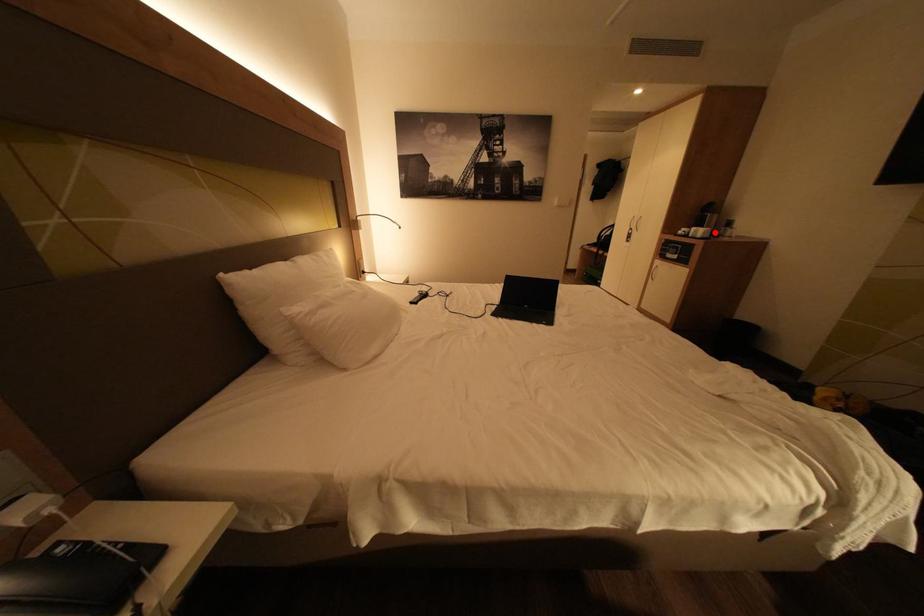
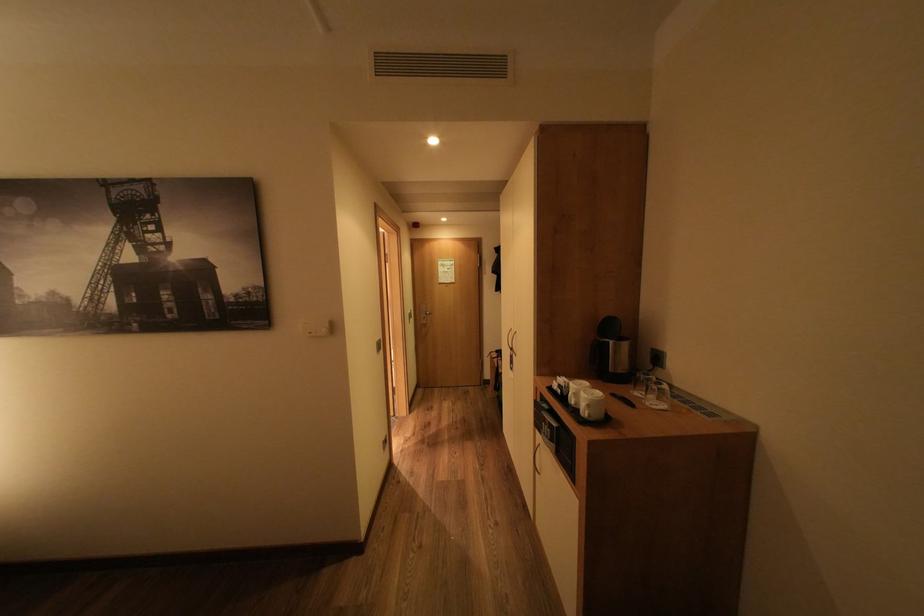
Question: I am providing you with two images of the same scene from different viewpoints. A red point is marked on the first image. Is the red point's position out of view in image 2?

Choices:
 (A) Yes
 (B) No

Answer: (B)